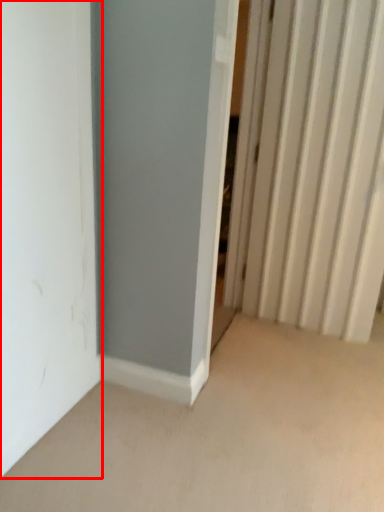
Question: Considering the relative positions of door (annotated by the red box) and radiator in the image provided, where is door (annotated by the red box) located with respect to the staircase?

Choices:
 (A) right
 (B) left

Answer: (B)